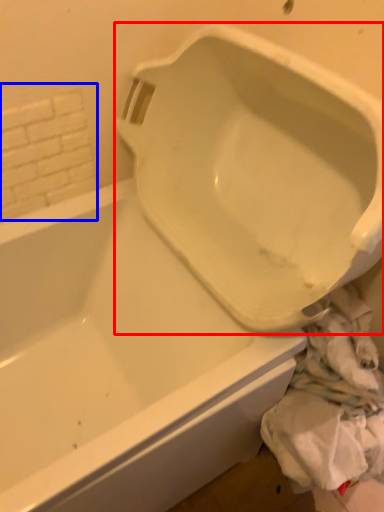
Question: Which object appears closest to the camera in this image, urinal (highlighted by a red box) or tile (highlighted by a blue box)?

Choices:
 (A) urinal
 (B) tile

Answer: (A)